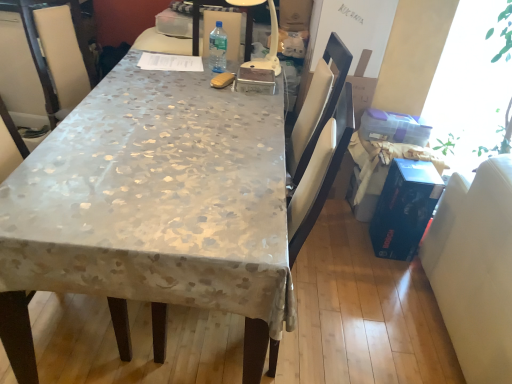
Question: Is clear plastic bottle at center located within white plastic lamp at center?

Choices:
 (A) yes
 (B) no

Answer: (B)

Question: Can you confirm if white plastic lamp at center is wider than clear plastic bottle at center?

Choices:
 (A) yes
 (B) no

Answer: (A)

Question: Considering the relative sizes of white plastic lamp at center and clear plastic bottle at center in the image provided, is white plastic lamp at center shorter than clear plastic bottle at center?

Choices:
 (A) yes
 (B) no

Answer: (B)

Question: Is white plastic lamp at center at the right side of clear plastic bottle at center?

Choices:
 (A) yes
 (B) no

Answer: (A)

Question: Does white plastic lamp at center turn towards clear plastic bottle at center?

Choices:
 (A) no
 (B) yes

Answer: (A)

Question: Is white plastic lamp at center closer to the viewer compared to clear plastic bottle at center?

Choices:
 (A) no
 (B) yes

Answer: (B)

Question: Can you confirm if blue cardboard box at right is smaller than white leather swivel chair at right?

Choices:
 (A) yes
 (B) no

Answer: (A)

Question: From the image's perspective, is blue cardboard box at right beneath white leather swivel chair at right?

Choices:
 (A) yes
 (B) no

Answer: (B)

Question: From a real-world perspective, is blue cardboard box at right located higher than white leather swivel chair at right?

Choices:
 (A) yes
 (B) no

Answer: (B)

Question: Could you tell me if blue cardboard box at right is turned towards white leather swivel chair at right?

Choices:
 (A) no
 (B) yes

Answer: (A)

Question: From a real-world perspective, is blue cardboard box at right below white leather swivel chair at right?

Choices:
 (A) no
 (B) yes

Answer: (B)

Question: Does blue cardboard box at right contain white leather swivel chair at right?

Choices:
 (A) yes
 (B) no

Answer: (B)

Question: Is silky beige tablecloth at center completely or partially inside clear plastic bottle at center?

Choices:
 (A) no
 (B) yes

Answer: (A)